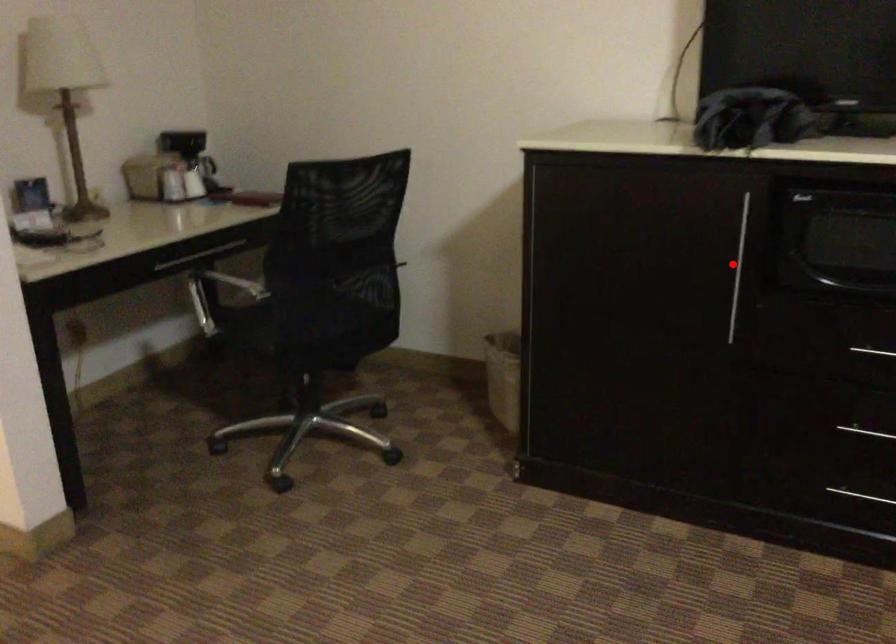
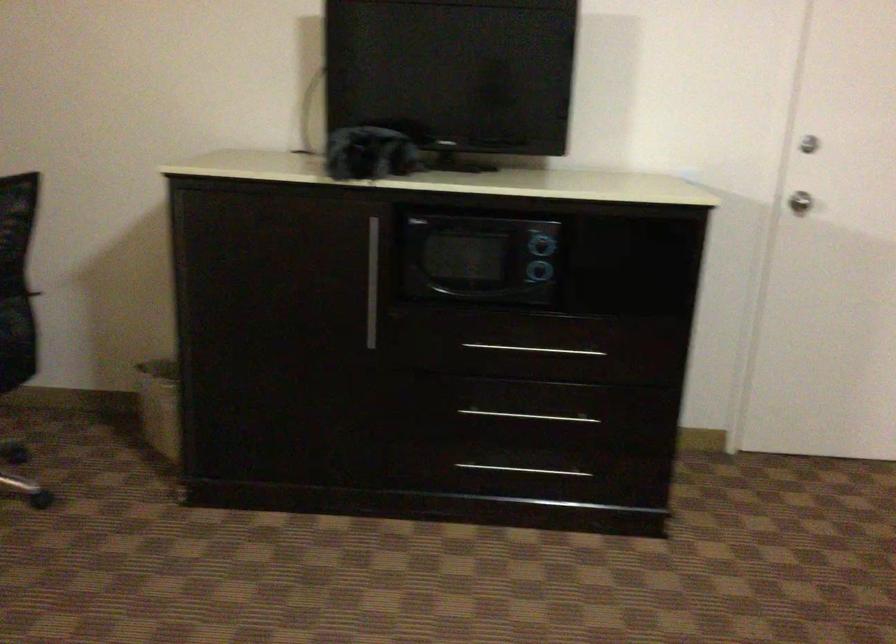
Question: I am providing you with two images of the same scene from different viewpoints. Given a red point in image1, look at the same physical point in image2. Is it:

Choices:
 (A) Closer to the viewpoint
 (B) Farther from the viewpoint

Answer: (B)